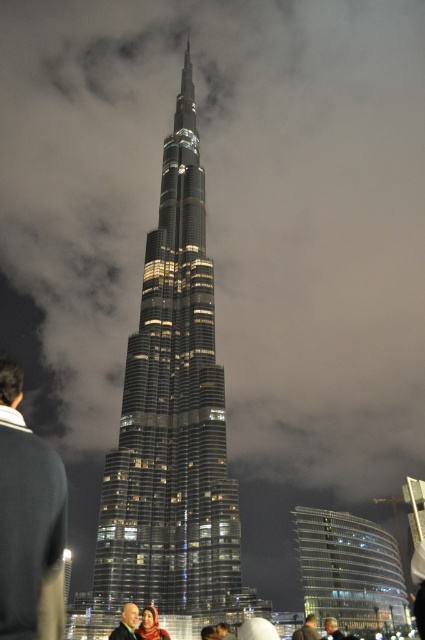
Question: Does transparent glass building at lower right have a smaller size compared to matte pink scarf at lower center?

Choices:
 (A) no
 (B) yes

Answer: (A)

Question: Can you confirm if matte pink scarf at lower center is positioned below dark hair at lower center?

Choices:
 (A) yes
 (B) no

Answer: (B)

Question: Which is nearer to the dark hair at lower center?

Choices:
 (A) dark blue sweater at lower left
 (B) glassy metallic skyscraper at center

Answer: (B)

Question: Is dark blue sweater at lower left positioned before dark brown leather jacket at center?

Choices:
 (A) yes
 (B) no

Answer: (A)

Question: Which point is farther to the camera?

Choices:
 (A) matte pink scarf at lower center
 (B) dark blue sweater at lower left
 (C) glassy metallic skyscraper at center
 (D) dark brown leather jacket at center

Answer: (C)

Question: Which of the following is the closest to the observer?

Choices:
 (A) (124, 525)
 (B) (377, 579)
 (C) (127, 624)

Answer: (C)